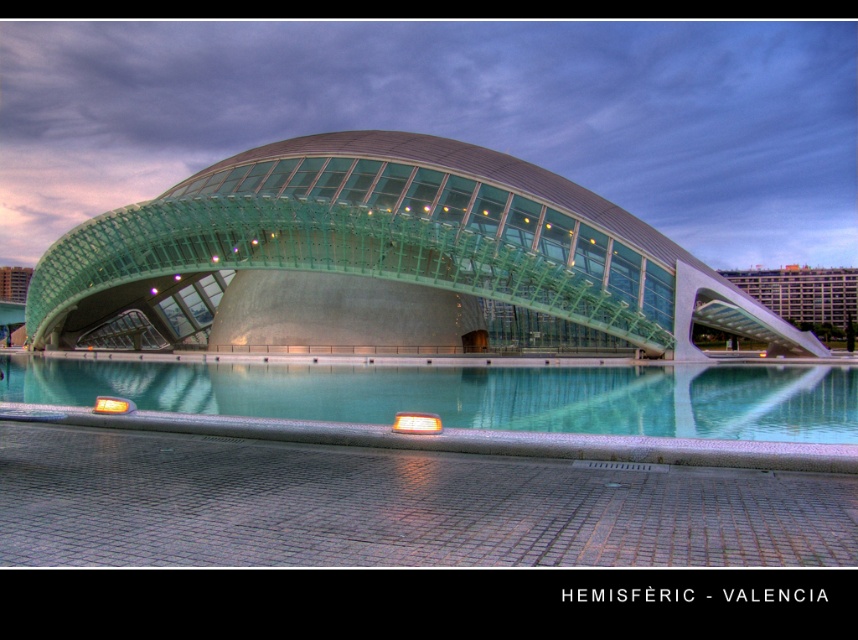
From the picture: Between transparent glass dome at center and clear glass water at center, which one is positioned higher?

Positioned higher is transparent glass dome at center.

In the scene shown: Can you confirm if transparent glass dome at center is taller than clear glass water at center?

Correct, transparent glass dome at center is much taller as clear glass water at center.

At what (x,y) coordinates should I click in order to perform the action: click on transparent glass dome at center. Please return your answer as a coordinate pair (x, y). The height and width of the screenshot is (640, 858). Looking at the image, I should click on (384, 257).

Looking at this image, does transparent glass dome at center appear over green glass building at right?

Correct, transparent glass dome at center is located above green glass building at right.

Image resolution: width=858 pixels, height=640 pixels. I want to click on transparent glass dome at center, so click(384, 257).

Between point (426, 380) and point (781, 300), which one is positioned behind?

The point (781, 300) is behind.

Does clear glass water at center appear on the left side of green glass building at right?

Correct, you'll find clear glass water at center to the left of green glass building at right.

Who is more distant from viewer, [236,372] or [726,272]?

The point [726,272] is more distant.

Where is `clear glass water at center`? The image size is (858, 640). clear glass water at center is located at coordinates (474, 394).